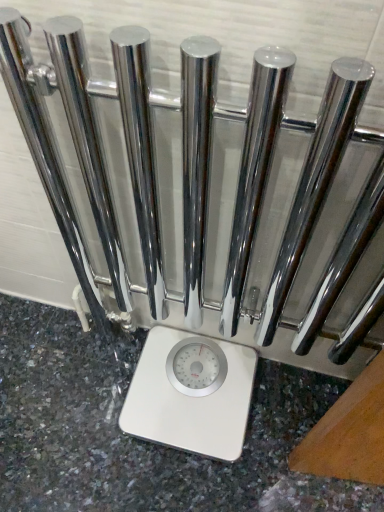
At what (x,y) coordinates should I click in order to perform the action: click on empty space that is ontop of white glossy granite at center (from a real-world perspective). Please return your answer as a coordinate pair (x, y). Image resolution: width=384 pixels, height=512 pixels. Looking at the image, I should click on (150, 419).